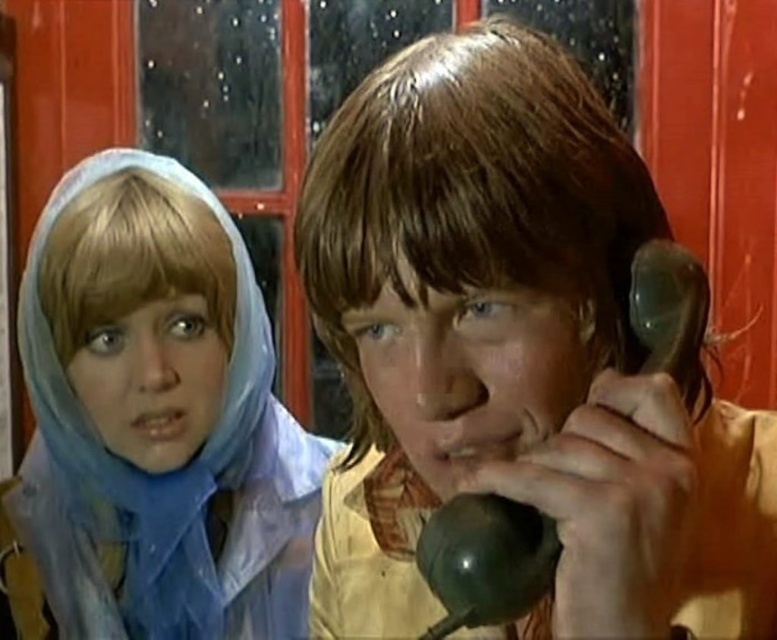
Question: Is shiny brown hair at center in front of blue sheer headscarf at upper left?

Choices:
 (A) yes
 (B) no

Answer: (A)

Question: Does shiny brown hair at center have a lesser width compared to blue sheer headscarf at upper left?

Choices:
 (A) yes
 (B) no

Answer: (A)

Question: Among these objects, which one is nearest to the camera?

Choices:
 (A) shiny brown hair at center
 (B) blue sheer headscarf at upper left

Answer: (A)

Question: Is shiny brown hair at center thinner than blue sheer headscarf at upper left?

Choices:
 (A) yes
 (B) no

Answer: (A)

Question: Among these points, which one is farthest from the camera?

Choices:
 (A) (561, 417)
 (B) (159, 336)

Answer: (B)